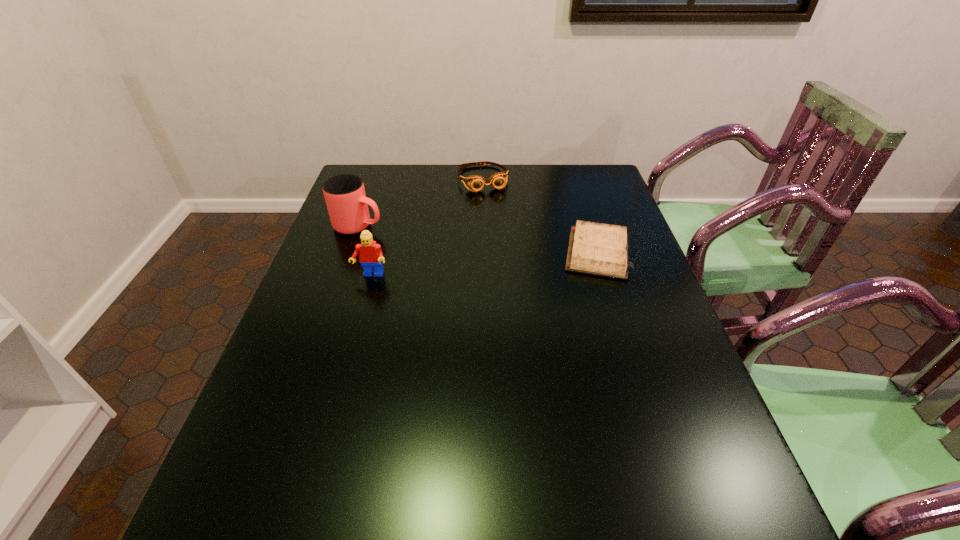
This screenshot has height=540, width=960. I want to click on blank region between the second shortest object and the cup, so click(x=421, y=202).

Find the location of `vacant area between the diary and the farthest object`. vacant area between the diary and the farthest object is located at coordinates (540, 215).

Identify which object is located as the nearest to the Lego. Please provide its 2D coordinates. Your answer should be formatted as a tuple, i.e. [(x, y)], where the tuple contains the x and y coordinates of a point satisfying the conditions above.

[(347, 204)]

The image size is (960, 540). Identify the location of the third closest object to the third object from left to right. (370, 254).